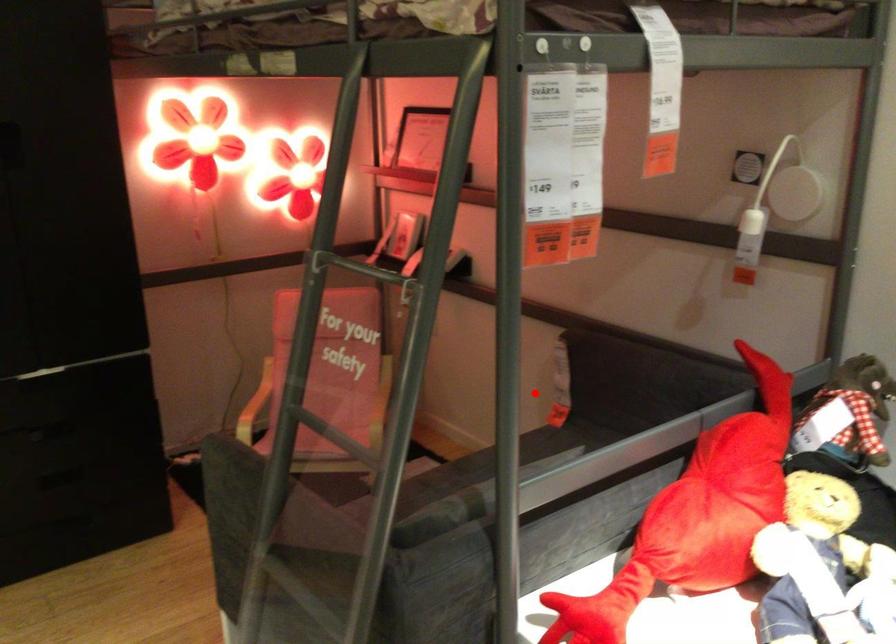
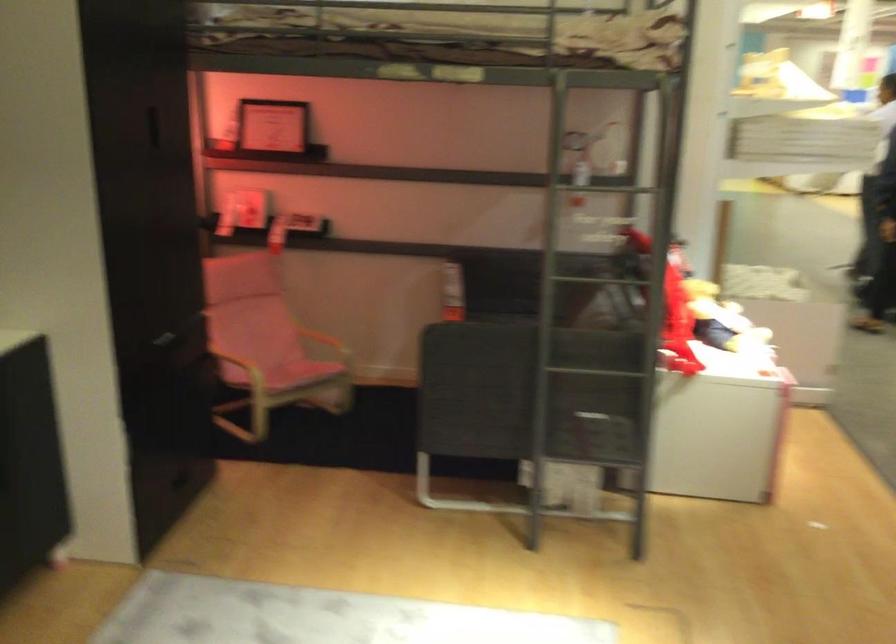
Question: A red point is marked in image1. In image2, is the corresponding 3D point closer to the camera or farther? Reply with the corresponding letter.

Choices:
 (A) The corresponding 3D point is closer.
 (B) The corresponding 3D point is farther.

Answer: (B)